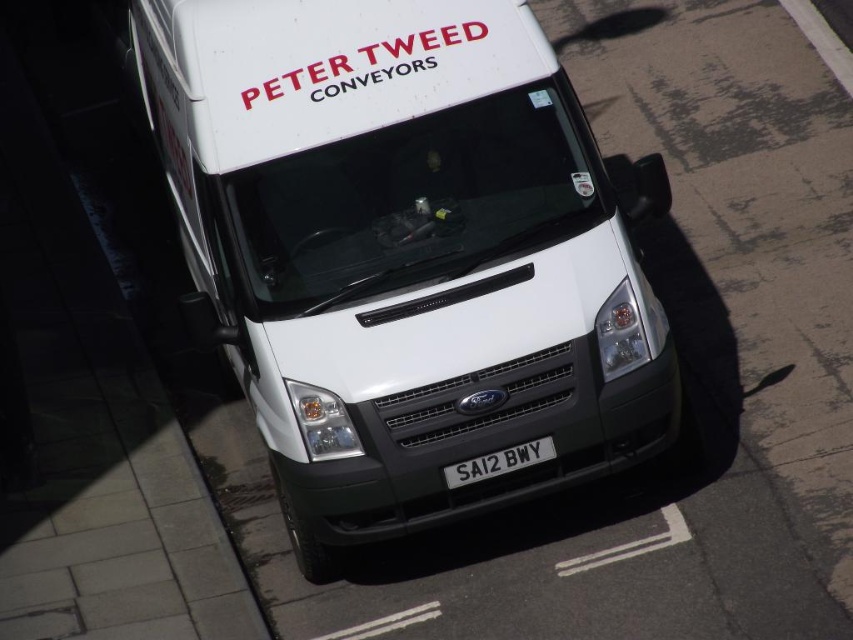
Does white matte van at center lie behind white metallic license plate at center?

No, it is in front of white metallic license plate at center.

Who is taller, white matte van at center or white metallic license plate at center?

With more height is white matte van at center.

The image size is (853, 640). What do you see at coordinates (402, 253) in the screenshot? I see `white matte van at center` at bounding box center [402, 253].

This screenshot has width=853, height=640. What are the coordinates of `white matte van at center` in the screenshot? It's located at (402, 253).